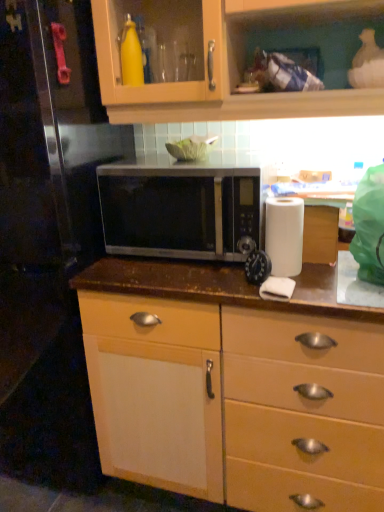
Question: Is satin silver microwave at center next to brown polished wood countertop at center and touching it?

Choices:
 (A) yes
 (B) no

Answer: (B)

Question: Is satin silver microwave at center to the left of brown polished wood countertop at center from the viewer's perspective?

Choices:
 (A) yes
 (B) no

Answer: (A)

Question: From a real-world perspective, is satin silver microwave at center beneath brown polished wood countertop at center?

Choices:
 (A) no
 (B) yes

Answer: (A)

Question: Can you confirm if satin silver microwave at center is thinner than brown polished wood countertop at center?

Choices:
 (A) yes
 (B) no

Answer: (A)

Question: Would you say satin silver microwave at center is a long distance from brown polished wood countertop at center?

Choices:
 (A) no
 (B) yes

Answer: (A)

Question: Could you tell me if satin silver microwave at center is turned towards brown polished wood countertop at center?

Choices:
 (A) yes
 (B) no

Answer: (B)

Question: Is black plastic clock at center turned away from satin silver microwave at center?

Choices:
 (A) no
 (B) yes

Answer: (B)

Question: Does black plastic clock at center have a lesser height compared to satin silver microwave at center?

Choices:
 (A) no
 (B) yes

Answer: (B)

Question: Does black plastic clock at center appear on the right side of satin silver microwave at center?

Choices:
 (A) no
 (B) yes

Answer: (B)

Question: Does black plastic clock at center have a greater width compared to satin silver microwave at center?

Choices:
 (A) no
 (B) yes

Answer: (A)

Question: Considering the relative sizes of black plastic clock at center and satin silver microwave at center in the image provided, is black plastic clock at center taller than satin silver microwave at center?

Choices:
 (A) no
 (B) yes

Answer: (A)

Question: From the image's perspective, would you say black plastic clock at center is positioned over satin silver microwave at center?

Choices:
 (A) no
 (B) yes

Answer: (A)

Question: Is black plastic clock at center at the right side of white matte paper towel at right?

Choices:
 (A) no
 (B) yes

Answer: (A)